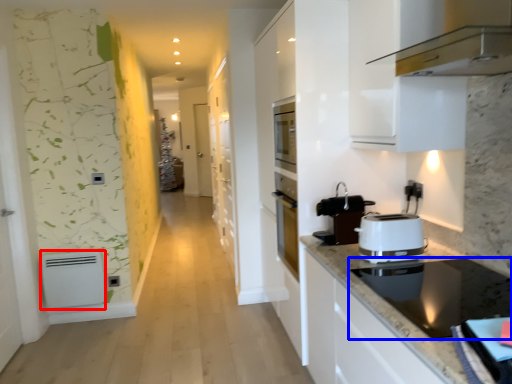
Question: Among these objects, which one is farthest to the camera, appliance (highlighted by a red box) or home appliance (highlighted by a blue box)?

Choices:
 (A) appliance
 (B) home appliance

Answer: (A)